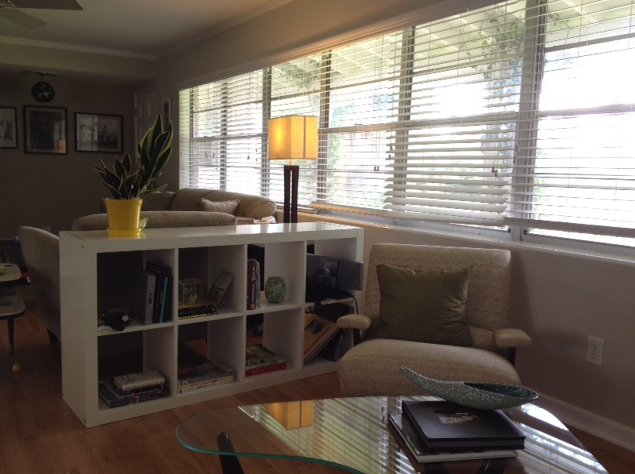
At what (x,y) coordinates should I click in order to perform the action: click on lamp shade. Please return your answer as a coordinate pair (x, y). This screenshot has width=635, height=474. Looking at the image, I should click on (291, 140).